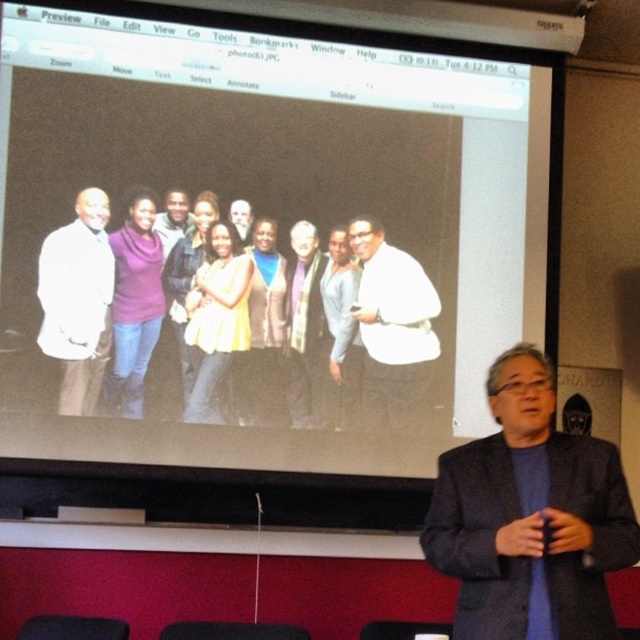
Question: Is white matte projection screen at upper center positioned behind gray wool blazer at right?

Choices:
 (A) no
 (B) yes

Answer: (B)

Question: Which point is closer to the camera?

Choices:
 (A) (120, 291)
 (B) (486, 528)

Answer: (B)

Question: Among these points, which one is nearest to the camera?

Choices:
 (A) (243, 240)
 (B) (161, 288)

Answer: (B)

Question: Does gray wool blazer at right have a lesser width compared to white matte shirt at center?

Choices:
 (A) yes
 (B) no

Answer: (B)

Question: Which point is closer to the camera?

Choices:
 (A) white matte projection screen at upper center
 (B) white matte jacket at left

Answer: (A)

Question: Is white matte projection screen at upper center below purple sweater at center?

Choices:
 (A) no
 (B) yes

Answer: (A)